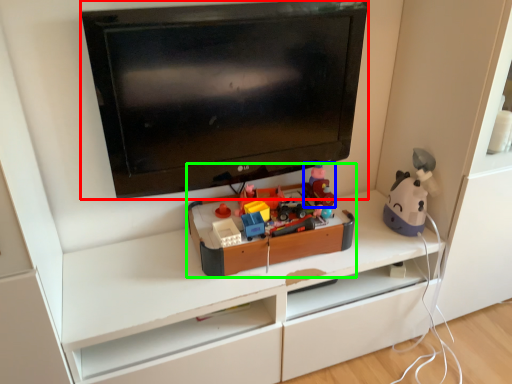
Question: Which is nearer to the television (highlighted by a red box)? toy (highlighted by a blue box) or toy (highlighted by a green box).

Choices:
 (A) toy
 (B) toy

Answer: (B)